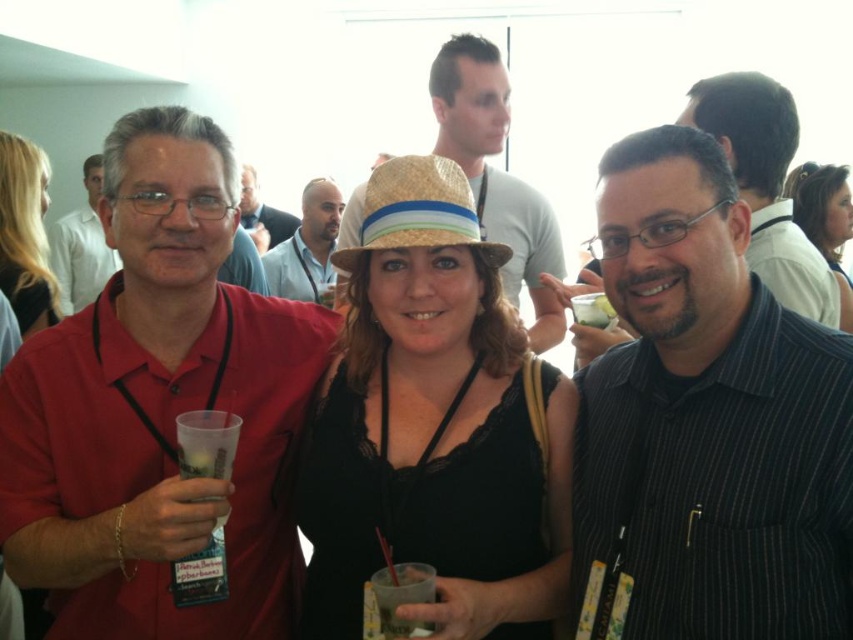
In the scene shown: Wait, the user provided conflicting object labels. There are two entries for a straw hat at the center, one labeled as natural straw hat at center and the other as strawhat at center. This inconsistency needs to be addressed. Please clarify the correct object labels to proceed with generating the question and answer.

The user provided conflicting object labels for the straw hat at the center. The correct object labels should be either natural straw hat at center or strawhat at center, but not both. Please resolve this discrepancy before proceeding.

You are at a party and want to introduce yourself to the person in the matte red shirt at center and the person in the black fabric dress at center. Which one should you approach first if you are standing to the right of both of them?

You should approach the matte red shirt at center first because it is to the left of the black fabric dress at center, so it is closer to your position on the right.